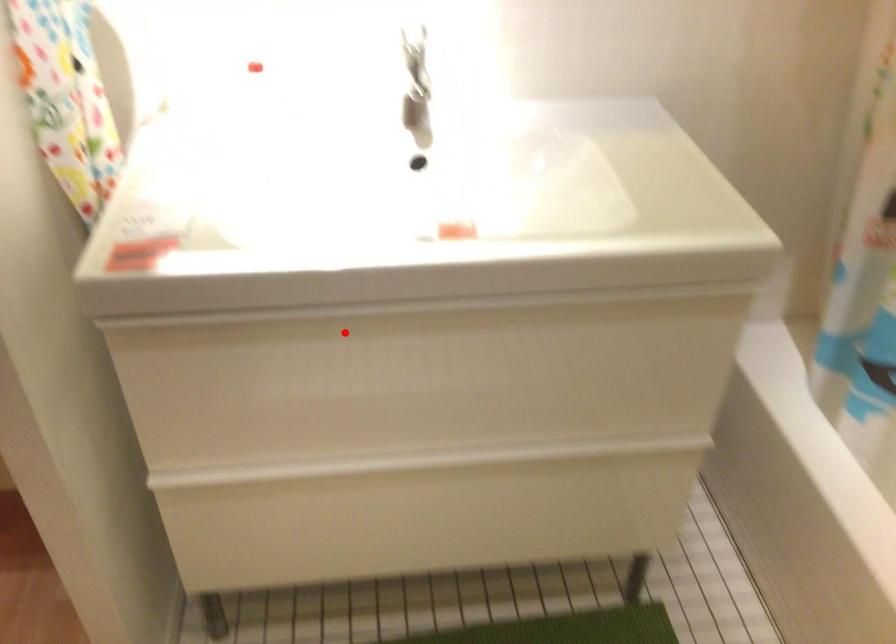
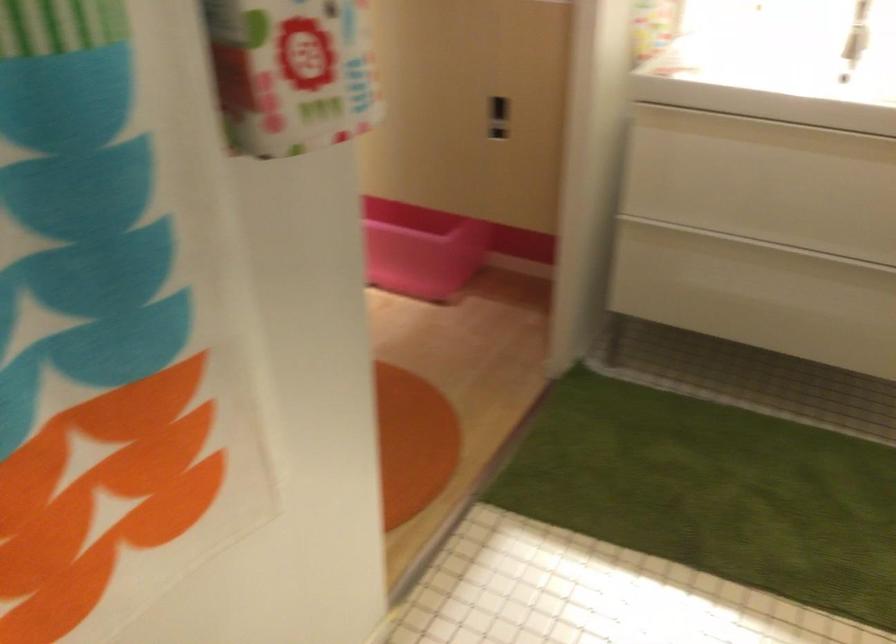
Where in the second image is the point corresponding to the highlighted location from the first image?

(764, 131)